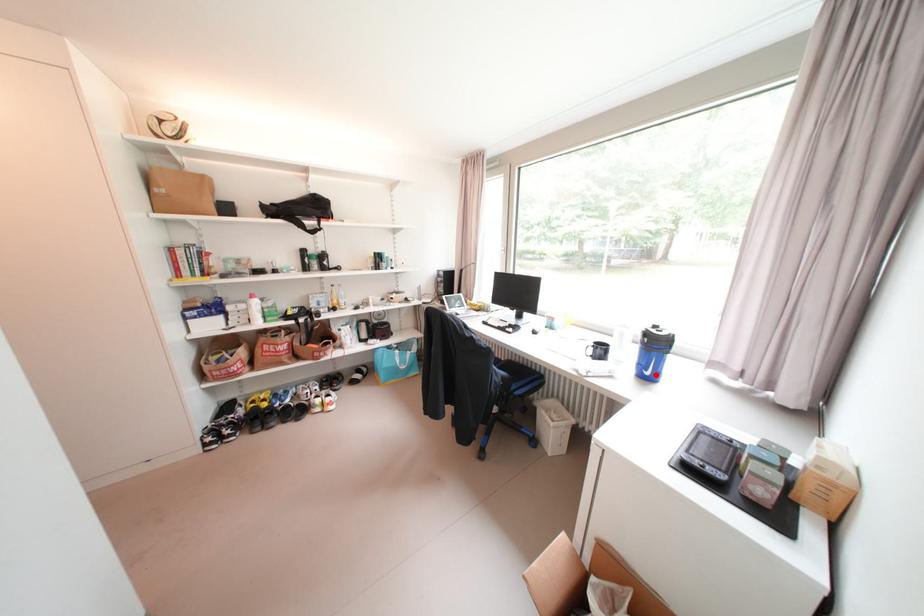
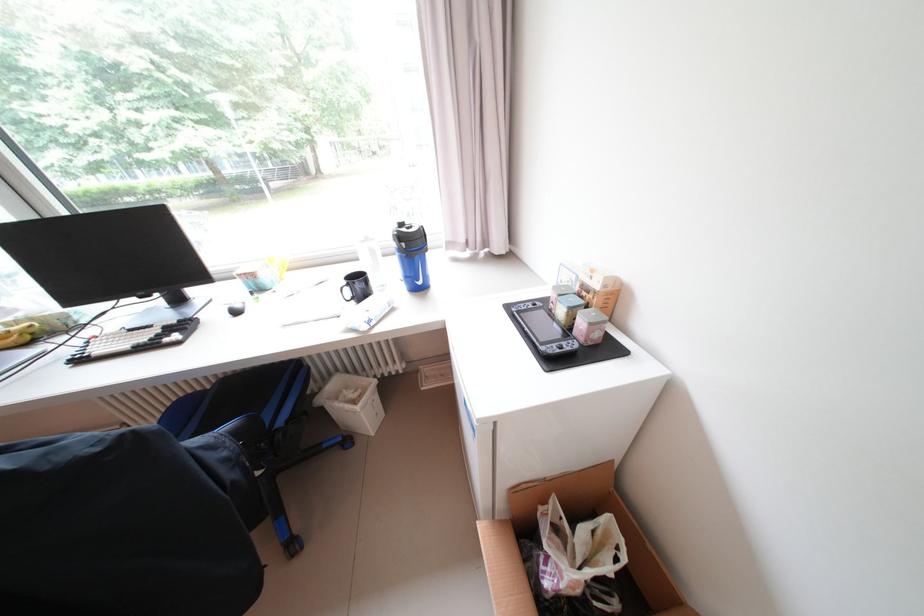
In the second image, find the point that corresponds to the highlighted location in the first image.

(428, 284)